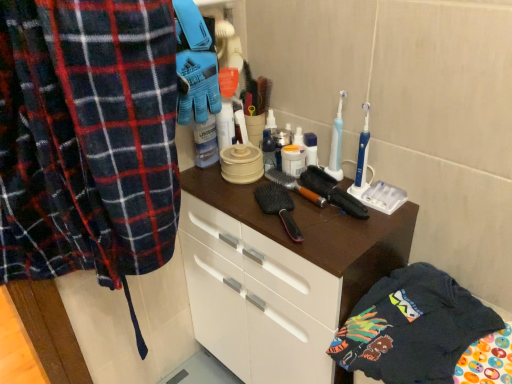
Question: From a real-world perspective, is brown matte cabinet at center physically below black rubber brush at center, the 2th brush when ordered from left to right?

Choices:
 (A) yes
 (B) no

Answer: (A)

Question: Is brown matte cabinet at center closer to camera compared to black rubber brush at center, the 2th brush when ordered from left to right?

Choices:
 (A) no
 (B) yes

Answer: (B)

Question: Is brown matte cabinet at center further to camera compared to black rubber brush at center, the 1th brush when ordered from right to left?

Choices:
 (A) yes
 (B) no

Answer: (B)

Question: Is brown matte cabinet at center facing towards black rubber brush at center, the 1th brush when ordered from right to left?

Choices:
 (A) no
 (B) yes

Answer: (A)

Question: Is brown matte cabinet at center taller than black rubber brush at center, the 1th brush when ordered from right to left?

Choices:
 (A) yes
 (B) no

Answer: (A)

Question: Does brown matte cabinet at center have a greater width compared to black rubber brush at center, the 1th brush when ordered from right to left?

Choices:
 (A) yes
 (B) no

Answer: (A)

Question: Is black rubber brush at center, the 1th brush when ordered from right to left, shorter than dark blue cotton t-shirt at lower right?

Choices:
 (A) no
 (B) yes

Answer: (B)

Question: Is black rubber brush at center, the 1th brush when ordered from right to left, facing towards dark blue cotton t-shirt at lower right?

Choices:
 (A) no
 (B) yes

Answer: (A)

Question: Is black rubber brush at center, the 2th brush when ordered from left to right, thinner than dark blue cotton t-shirt at lower right?

Choices:
 (A) yes
 (B) no

Answer: (A)

Question: Is the depth of black rubber brush at center, the 2th brush when ordered from left to right, less than that of dark blue cotton t-shirt at lower right?

Choices:
 (A) no
 (B) yes

Answer: (A)

Question: Considering the relative sizes of black rubber brush at center, the 1th brush when ordered from right to left, and dark blue cotton t-shirt at lower right in the image provided, is black rubber brush at center, the 1th brush when ordered from right to left, smaller than dark blue cotton t-shirt at lower right?

Choices:
 (A) no
 (B) yes

Answer: (B)

Question: Is dark blue cotton t-shirt at lower right surrounded by black rubber brush at center, the 2th brush when ordered from left to right?

Choices:
 (A) yes
 (B) no

Answer: (B)

Question: Is black rubber brush at center, the 2th brush when ordered from left to right, thinner than brown wooden brush at center, the 2th brush from the right?

Choices:
 (A) no
 (B) yes

Answer: (A)